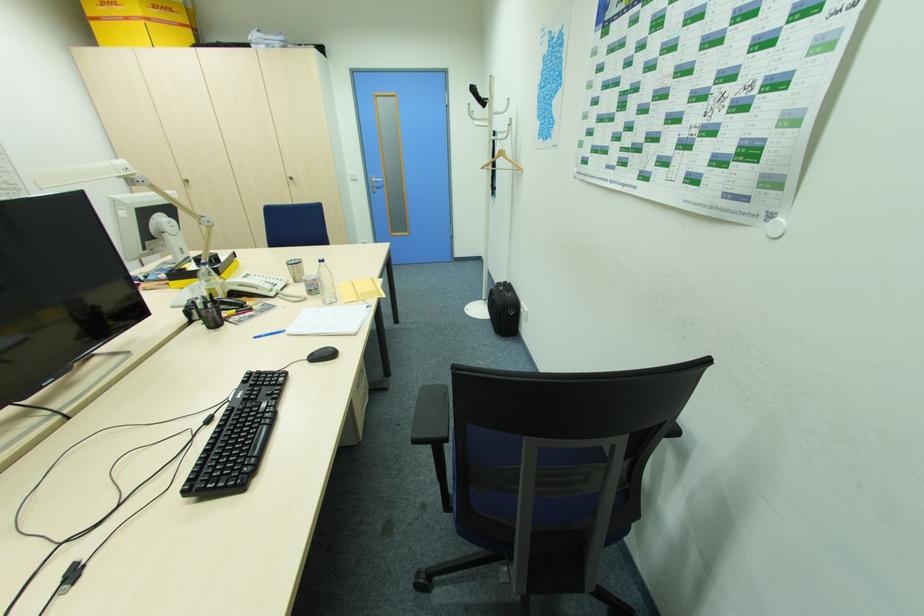
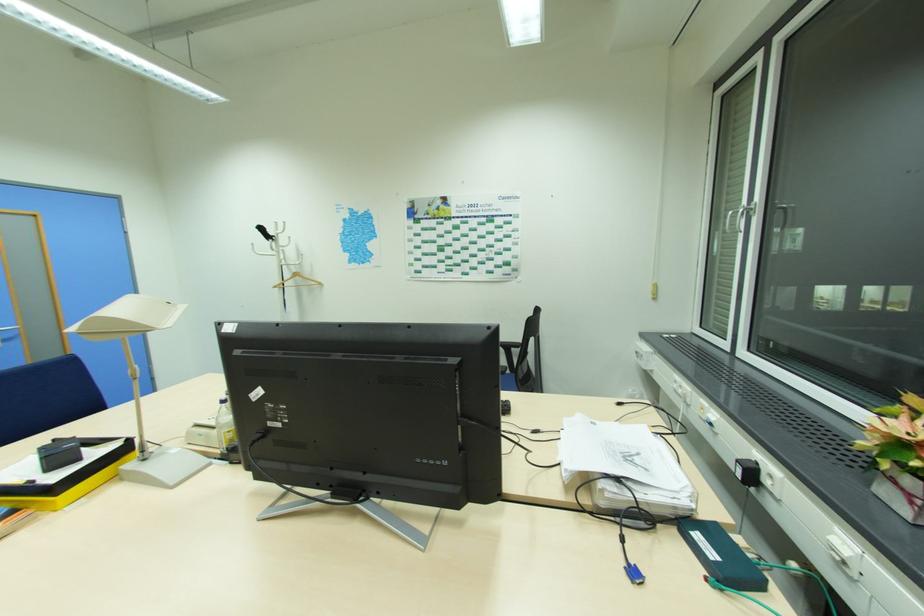
Locate, in the second image, the point that corresponds to [382,185] in the first image.

(11, 337)